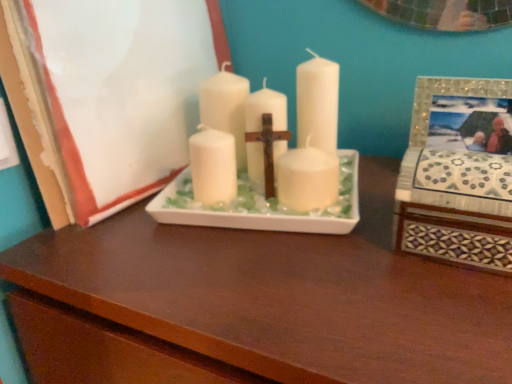
The image size is (512, 384). What are the coordinates of `empty space that is ontop of matte white tray at center` in the screenshot? It's located at (322, 252).